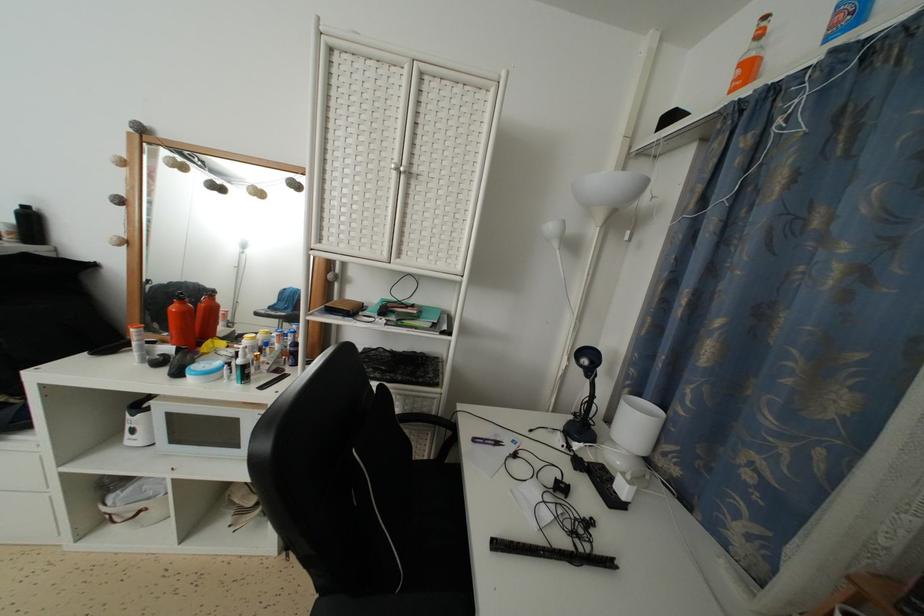
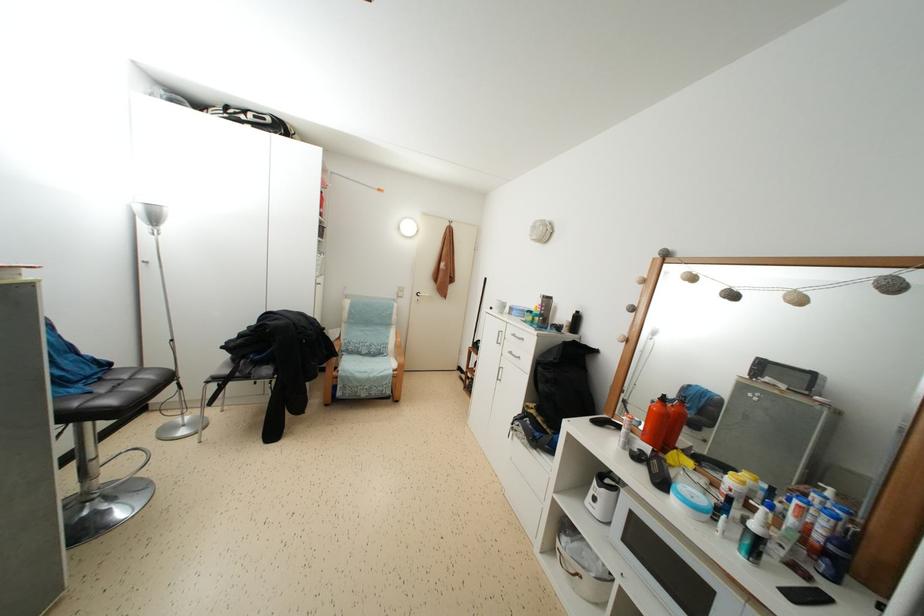
Where in the second image is the point corresponding to [248,373] from the first image?

(763, 546)